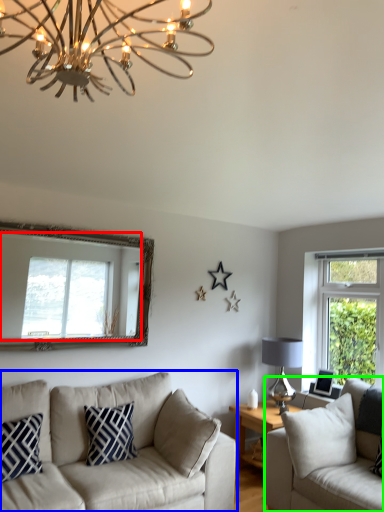
Question: Based on their relative distances, which object is farther from window (highlighted by a red box)? Choose from studio couch (highlighted by a blue box) and studio couch (highlighted by a green box).

Choices:
 (A) studio couch
 (B) studio couch

Answer: (B)